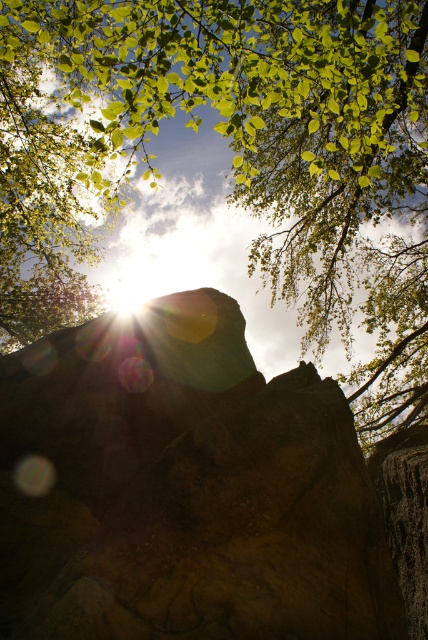
Question: Among these points, which one is nearest to the camera?

Choices:
 (A) (315, 65)
 (B) (32, 561)

Answer: (A)

Question: Can you confirm if brown rough rock at center is positioned below green leafy tree at upper center?

Choices:
 (A) yes
 (B) no

Answer: (A)

Question: Among these objects, which one is farthest from the camera?

Choices:
 (A) brown rough rock at center
 (B) green leafy tree at upper center

Answer: (B)

Question: Can you confirm if brown rough rock at center is positioned below green leafy tree at upper center?

Choices:
 (A) no
 (B) yes

Answer: (B)

Question: Can you confirm if brown rough rock at center is positioned to the left of green leafy tree at upper center?

Choices:
 (A) yes
 (B) no

Answer: (A)

Question: Which point is closer to the camera?

Choices:
 (A) green leafy tree at upper center
 (B) brown rough rock at center

Answer: (B)